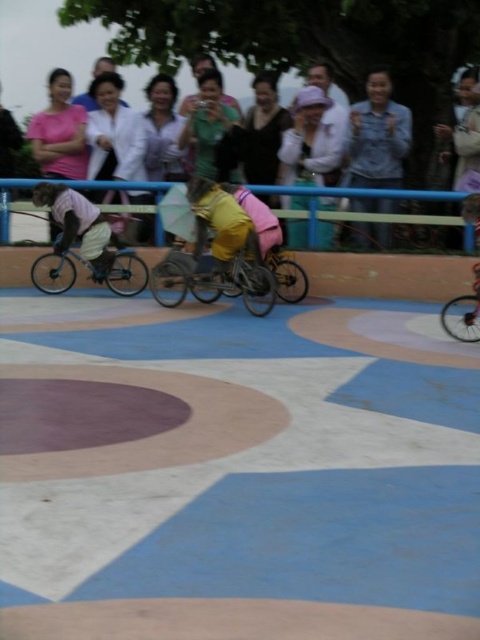
Does point (68, 93) lie in front of point (192, 156)?

Yes, point (68, 93) is closer to viewer.

Can you confirm if pink fabric at upper left is taller than matte green shirt at center?

No, pink fabric at upper left is not taller than matte green shirt at center.

Between point (51, 240) and point (206, 145), which one is positioned in front?

Positioned in front is point (206, 145).

The image size is (480, 640). What are the coordinates of `pink fabric at upper left` in the screenshot? It's located at (60, 132).

What do you see at coordinates (60, 132) in the screenshot?
I see `pink fabric at upper left` at bounding box center [60, 132].

Is point (66, 90) farther from camera compared to point (39, 282)?

That is True.

Does point (75, 106) lie behind point (46, 252)?

Yes, it is behind point (46, 252).

I want to click on pink fabric at upper left, so click(x=60, y=132).

Which of these two, silver metallic bicycle at center or pink fabric at upper right, stands shorter?

Standing shorter between the two is silver metallic bicycle at center.

Who is more distant from viewer, (46, 276) or (451, 150)?

The point (451, 150) is more distant.

The height and width of the screenshot is (640, 480). Identify the location of silver metallic bicycle at center. (91, 273).